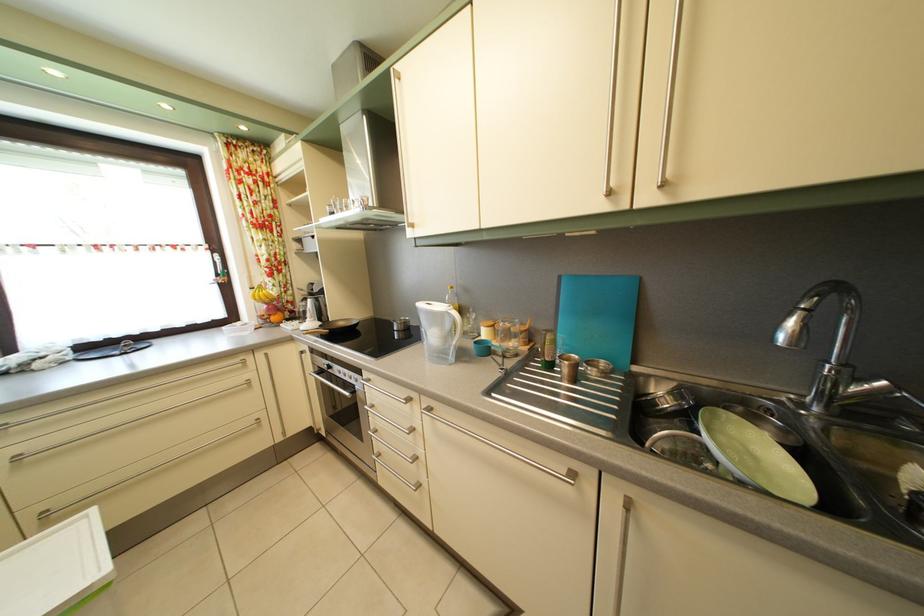
Image resolution: width=924 pixels, height=616 pixels. Identify the location of window handle. (128, 347).